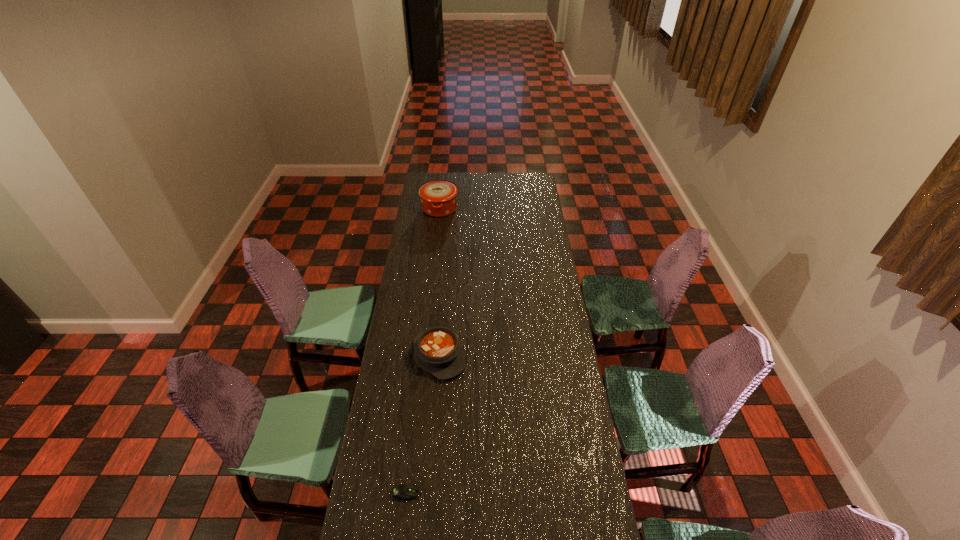
Choose which object is the second nearest neighbor to the shorter casserole. Please provide its 2D coordinates. Your answer should be formatted as a tuple, i.e. [(x, y)], where the tuple contains the x and y coordinates of a point satisfying the conditions above.

[(438, 197)]

In order to click on the second closest object to the farthest object in this screenshot , I will do `click(401, 492)`.

Where is `free location that satisfies the following two spatial constraints: 1. on the front side of the second tallest object; 2. on the wheel side of the nearest object`? free location that satisfies the following two spatial constraints: 1. on the front side of the second tallest object; 2. on the wheel side of the nearest object is located at coordinates (428, 492).